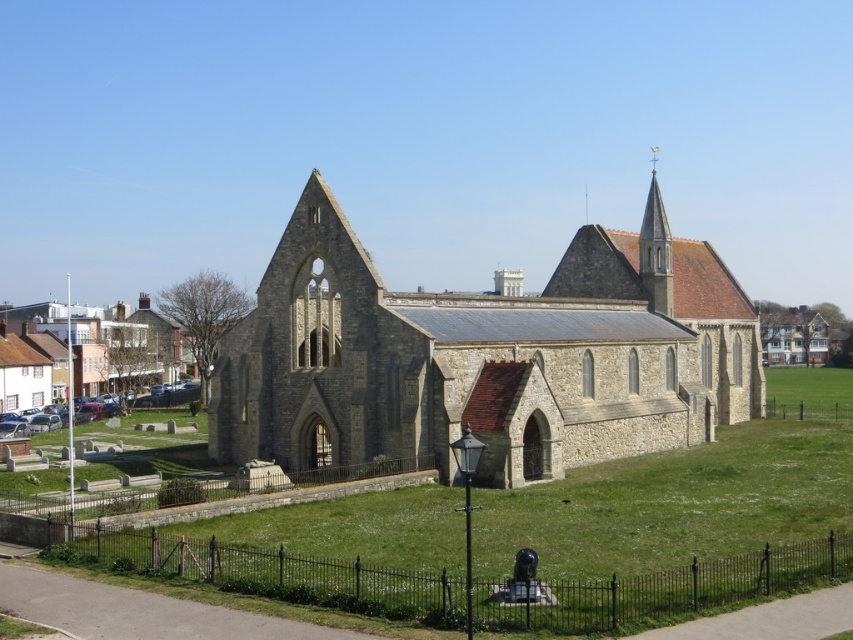
Can you confirm if stone church at center is thinner than smooth stone spire at upper right?

No.

Who is positioned more to the left, stone church at center or smooth stone spire at upper right?

From the viewer's perspective, stone church at center appears more on the left side.

Find the location of a particular element. stone church at center is located at coordinates (479, 358).